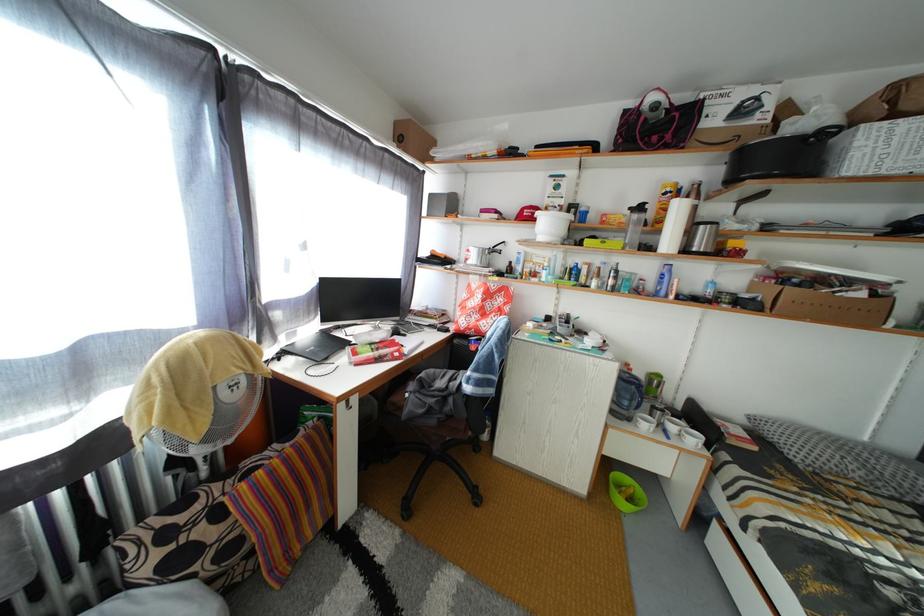
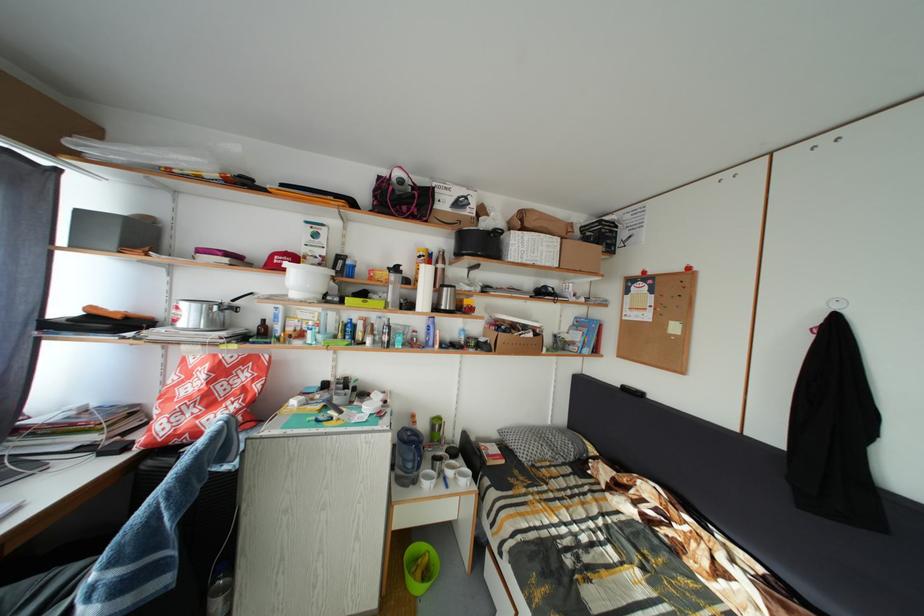
Locate, in the second image, the point that corresponds to the point at 637,402 in the first image.

(419, 464)